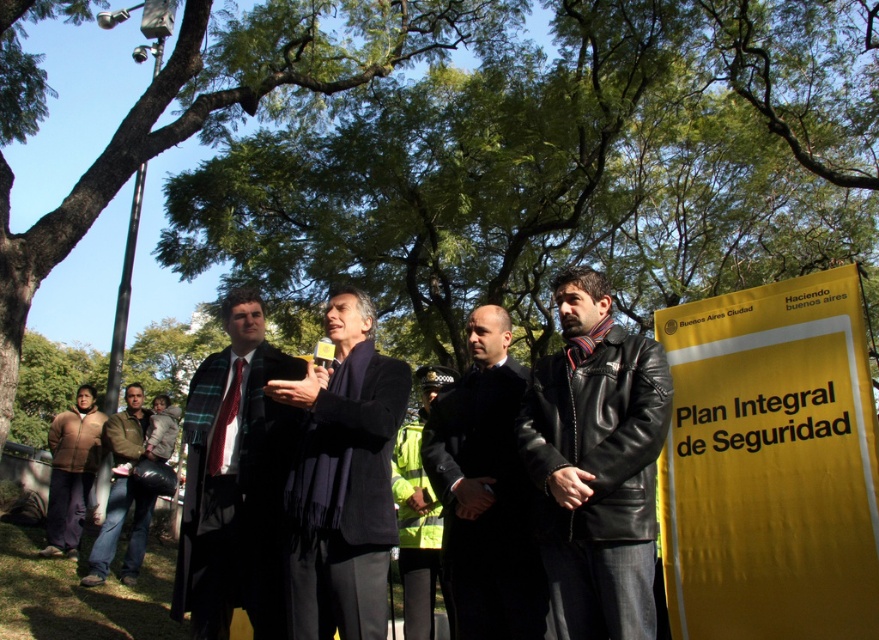
Is green leafy tree at upper center thinner than dark gray wool scarf at center?

No.

Can you confirm if green leafy tree at upper center is shorter than dark gray wool scarf at center?

No.

At what (x,y) coordinates should I click in order to perform the action: click on green leafy tree at upper center. Please return your answer as a coordinate pair (x, y). The height and width of the screenshot is (640, 879). Looking at the image, I should click on (198, 104).

Where is `green leafy tree at upper center`? The image size is (879, 640). green leafy tree at upper center is located at coordinates (198, 104).

Is yellow paper sign at right closer to the viewer compared to reflective yellow jacket at center?

Yes, yellow paper sign at right is in front of reflective yellow jacket at center.

Which of these two, yellow paper sign at right or reflective yellow jacket at center, stands shorter?

Standing shorter between the two is yellow paper sign at right.

Is point (861, 476) less distant than point (396, 472)?

Yes, it is in front of point (396, 472).

I want to click on yellow paper sign at right, so click(769, 464).

Is dark gray wool scarf at center positioned at the back of brown fuzzy jacket at lower left?

No, it is in front of brown fuzzy jacket at lower left.

Can you confirm if dark gray wool scarf at center is positioned to the right of brown fuzzy jacket at lower left?

Correct, you'll find dark gray wool scarf at center to the right of brown fuzzy jacket at lower left.

Between point (304, 577) and point (71, 488), which one is positioned behind?

The point (71, 488) is more distant.

This screenshot has width=879, height=640. In order to click on dark gray wool scarf at center in this screenshot , I will do `click(343, 477)`.